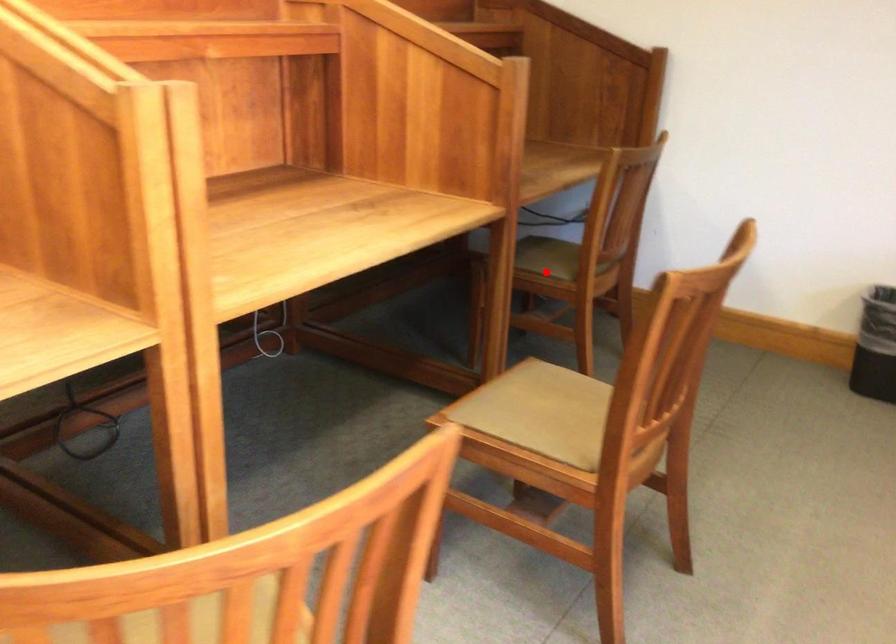
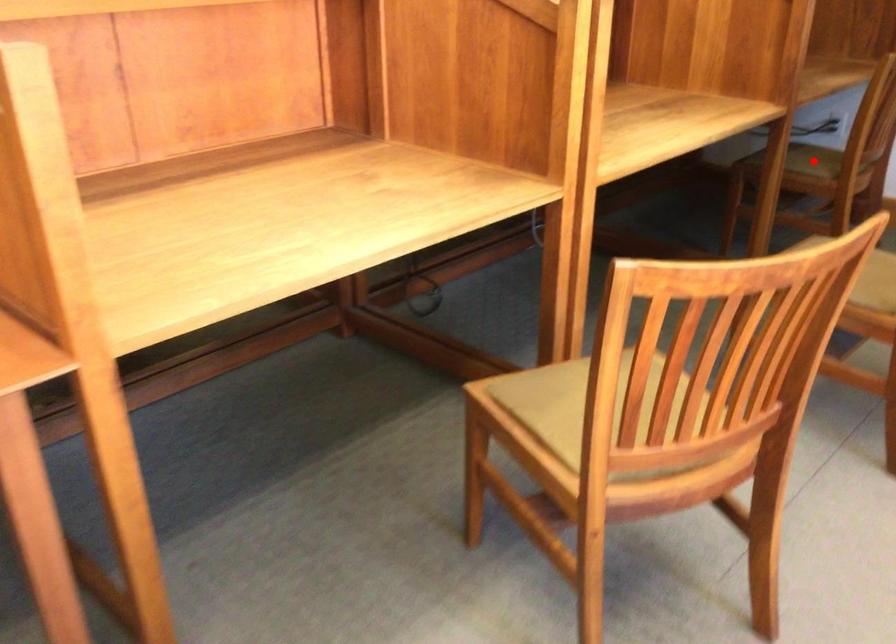
I am providing you with two images of the same scene from different viewpoints. A red point is marked on the first image and another point is marked on the second image. Is the red point in image1 aligned with the point shown in image2?

Yes